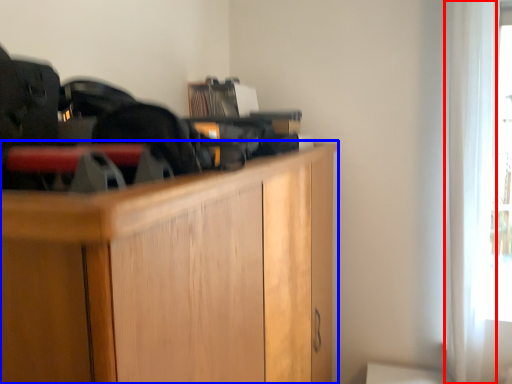
Question: Which object is further to the camera taking this photo, curtain (highlighted by a red box) or cabinetry (highlighted by a blue box)?

Choices:
 (A) curtain
 (B) cabinetry

Answer: (A)